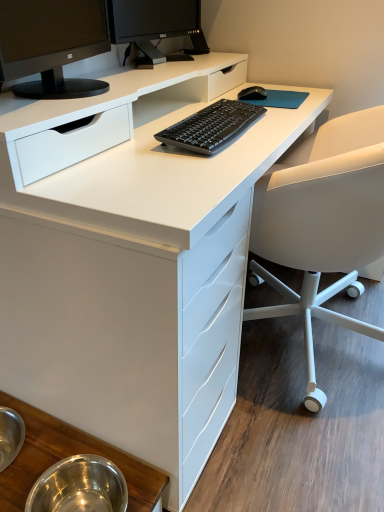
Question: Is white matte office chair at right thinner than black glossy monitor at upper center, marked as the 2th computer monitor in a front-to-back arrangement?

Choices:
 (A) yes
 (B) no

Answer: (B)

Question: Is white matte office chair at right in contact with black glossy monitor at upper center, marked as the 2th computer monitor in a front-to-back arrangement?

Choices:
 (A) no
 (B) yes

Answer: (A)

Question: From a real-world perspective, is white matte office chair at right positioned under black glossy monitor at upper center, marked as the 2th computer monitor in a front-to-back arrangement, based on gravity?

Choices:
 (A) yes
 (B) no

Answer: (A)

Question: Can you confirm if white matte office chair at right is bigger than black glossy monitor at upper center, marked as the 2th computer monitor in a front-to-back arrangement?

Choices:
 (A) yes
 (B) no

Answer: (A)

Question: Does white matte office chair at right come in front of black glossy monitor at upper center, which ranks as the 1th computer monitor in back-to-front order?

Choices:
 (A) no
 (B) yes

Answer: (B)

Question: Is matte black monitor at upper left, the 1th computer monitor positioned from the front, inside the boundaries of metallic stainless steel bowls at lower left, or outside?

Choices:
 (A) inside
 (B) outside

Answer: (B)

Question: Based on their sizes in the image, would you say matte black monitor at upper left, the 1th computer monitor positioned from the front, is bigger or smaller than metallic stainless steel bowls at lower left?

Choices:
 (A) small
 (B) big

Answer: (B)

Question: Considering their positions, is matte black monitor at upper left, the 2th computer monitor from the back, located in front of or behind metallic stainless steel bowls at lower left?

Choices:
 (A) behind
 (B) front

Answer: (B)

Question: From a real-world perspective, relative to metallic stainless steel bowls at lower left, is matte black monitor at upper left, the 1th computer monitor positioned from the front, vertically above or below?

Choices:
 (A) above
 (B) below

Answer: (A)

Question: In terms of width, does white matte office chair at right look wider or thinner when compared to black glossy monitor at upper center, marked as the 2th computer monitor in a front-to-back arrangement?

Choices:
 (A) thin
 (B) wide

Answer: (B)

Question: Is point (332, 188) positioned closer to the camera than point (132, 31)?

Choices:
 (A) farther
 (B) closer

Answer: (B)

Question: From a real-world perspective, is white matte office chair at right above or below black glossy monitor at upper center, marked as the 2th computer monitor in a front-to-back arrangement?

Choices:
 (A) below
 (B) above

Answer: (A)

Question: Is white matte office chair at right situated inside black glossy monitor at upper center, marked as the 2th computer monitor in a front-to-back arrangement, or outside?

Choices:
 (A) inside
 (B) outside

Answer: (B)

Question: From the image's perspective, relative to black glossy monitor at upper center, marked as the 2th computer monitor in a front-to-back arrangement, is black matte keyboard at center above or below?

Choices:
 (A) below
 (B) above

Answer: (A)

Question: Considering the positions of black matte keyboard at center and black glossy monitor at upper center, marked as the 2th computer monitor in a front-to-back arrangement, in the image, is black matte keyboard at center taller or shorter than black glossy monitor at upper center, marked as the 2th computer monitor in a front-to-back arrangement,?

Choices:
 (A) short
 (B) tall

Answer: (A)